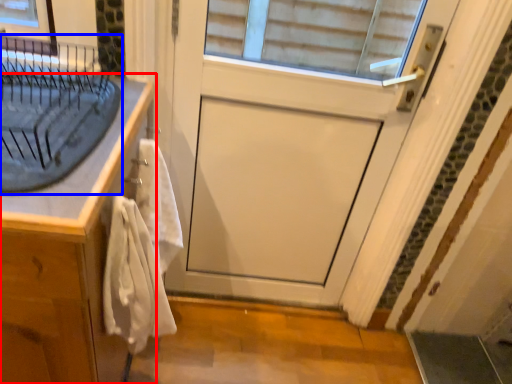
Question: Among these objects, which one is farthest to the camera, cabinetry (highlighted by a red box) or sink (highlighted by a blue box)?

Choices:
 (A) cabinetry
 (B) sink

Answer: (A)